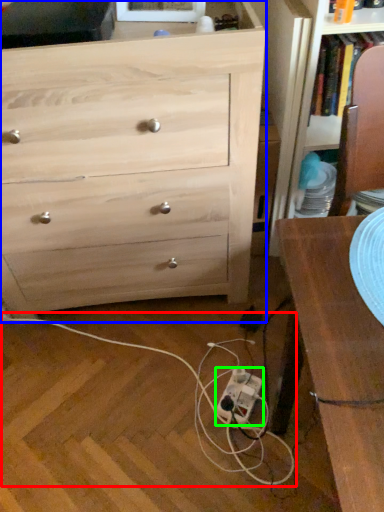
Question: Which object is the farthest from string (highlighted by a red box)? Choose among these: chest of drawers (highlighted by a blue box) or extension cord (highlighted by a green box).

Choices:
 (A) chest of drawers
 (B) extension cord

Answer: (A)